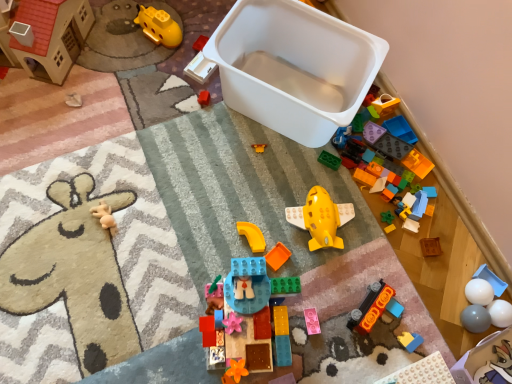
Identify the location of vacant space in front of white plastic tray at upper center, acting as the fourth toy starting from the left. click(190, 115).